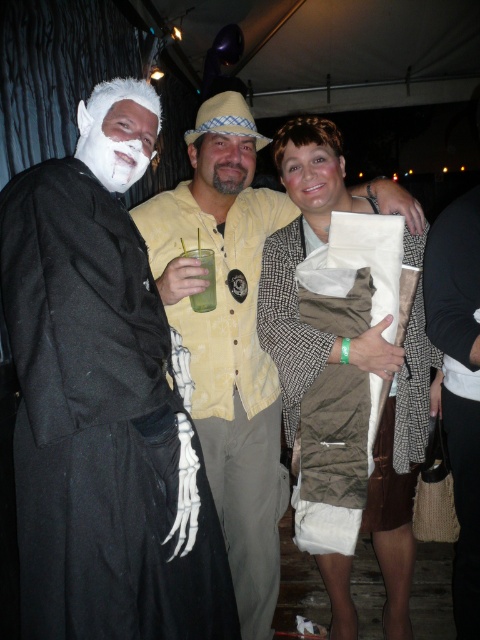
Is matte brown paper bag at center further to camera compared to green translucent plastic cup at center?

No.

Which is behind, point (310, 380) or point (203, 266)?

The point (310, 380) is more distant.

The image size is (480, 640). I want to click on matte brown paper bag at center, so click(363, 372).

Locate an element on the screen. matte brown paper bag at center is located at coordinates (363, 372).

Who is more forward, (176, 372) or (205, 308)?

Point (176, 372) is in front.

Locate an element on the screen. The height and width of the screenshot is (640, 480). matte black coat at left is located at coordinates (101, 426).

In order to click on matte black coat at left in this screenshot , I will do `click(101, 426)`.

Find the location of `matte black coat at left`. matte black coat at left is located at coordinates (101, 426).

Is point (107, 154) positioned in front of point (233, 168)?

That is True.

Who is more forward, (x=142, y=106) or (x=212, y=188)?

Positioned in front is point (x=142, y=106).

This screenshot has width=480, height=640. Find the location of `white matte face at center`. white matte face at center is located at coordinates (120, 145).